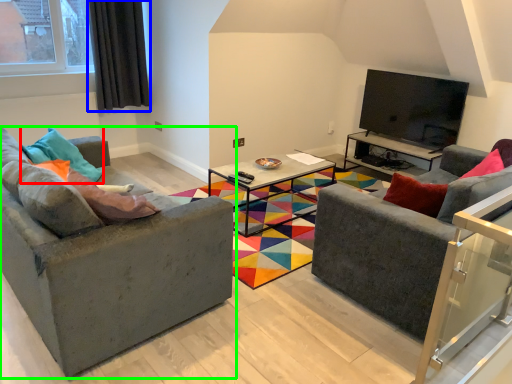
Question: Estimate the real-world distances between objects in this image. Which object is closer to pillow (highlighted by a red box), curtain (highlighted by a blue box) or studio couch (highlighted by a green box)?

Choices:
 (A) curtain
 (B) studio couch

Answer: (B)